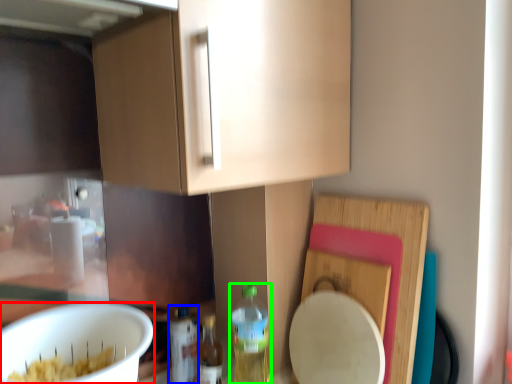
Question: Considering the real-world distances, which object is farthest from mixing bowl (highlighted by a red box)? bottle (highlighted by a blue box) or bottle (highlighted by a green box)?

Choices:
 (A) bottle
 (B) bottle

Answer: (B)